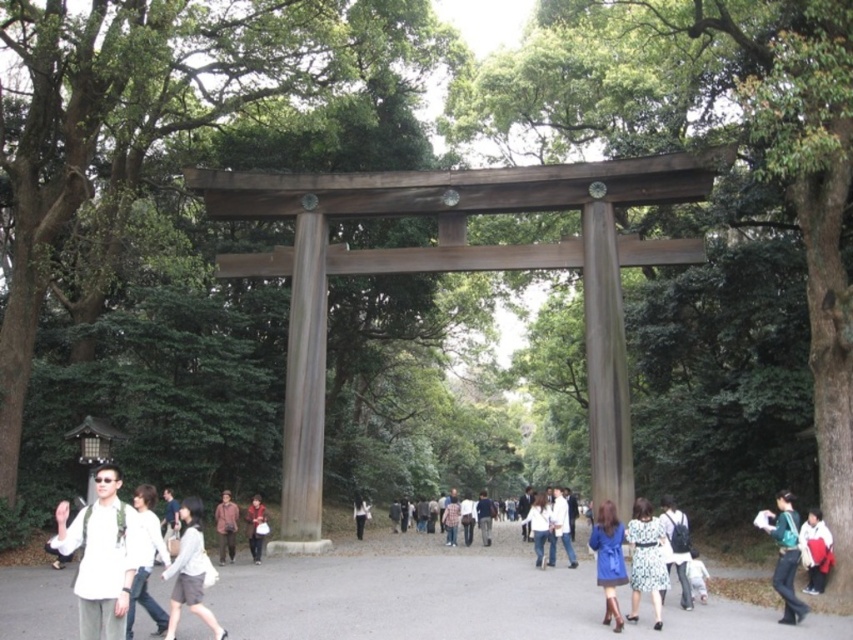
You are standing at the center of the torii gate and want to pick up the red fabric jacket at lower right. In which direction should you move to reach it?

The red fabric jacket at lower right is located at coordinates point (816, 552), so you should move towards the lower right direction to reach it.

You are a traveler who wants to pack both the patterned fabric dress at center and the matte gray backpack at center into a luggage. The luggage has a capacity of 20 liters. If the dress takes up 15 liters and the backpack takes up 5 liters, will both items fit?

The patterned fabric dress at center is bigger than the matte gray backpack at center. Since the dress takes up 15 liters and the backpack takes up 5 liters, together they occupy 20 liters. Therefore, both items will exactly fit into the 20 liter luggage.

You are standing in front of the torii gate and see a red fabric jacket at lower right and a denim jacket at center. Which jacket is positioned more to the east if the torii gate faces north?

The red fabric jacket at lower right is positioned to the right of the denim jacket at center. Since the torii gate faces north, the right side would correspond to the east direction. Therefore, the red fabric jacket at lower right is more to the east.